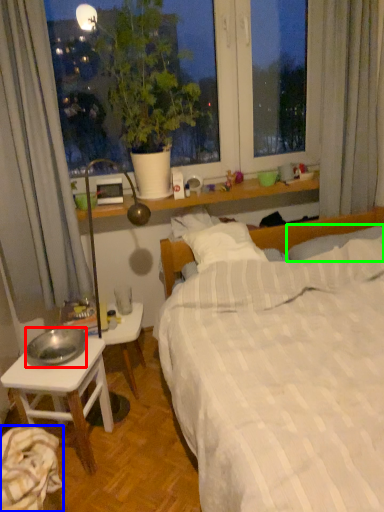
Question: Based on their relative distances, which object is nearer to bowl (highlighted by a red box)? Choose from sheet (highlighted by a blue box) and pillow (highlighted by a green box).

Choices:
 (A) sheet
 (B) pillow

Answer: (A)